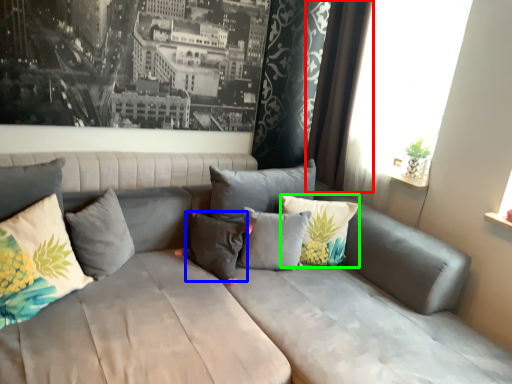
Question: Which is nearer to the curtain (highlighted by a red box)? pillow (highlighted by a blue box) or pillow (highlighted by a green box).

Choices:
 (A) pillow
 (B) pillow

Answer: (B)